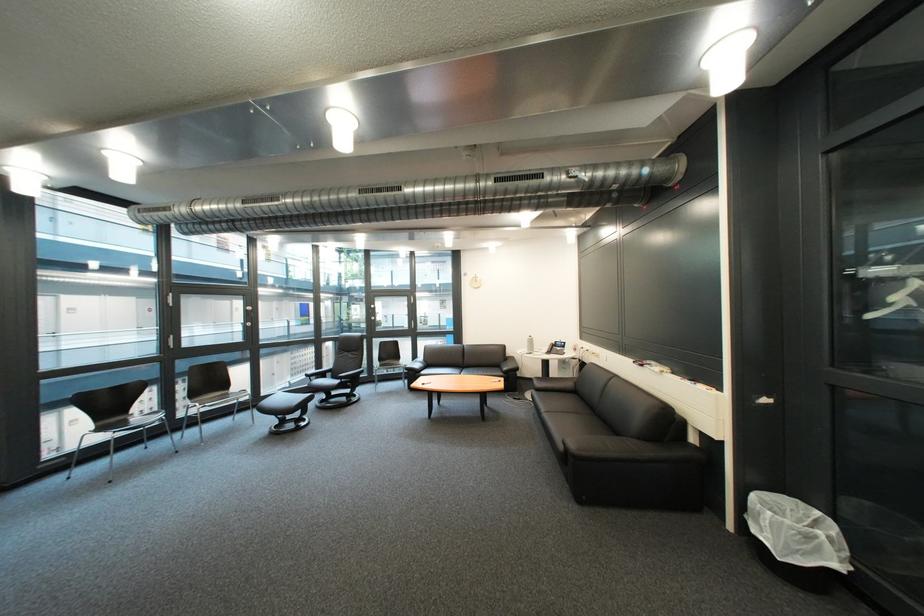
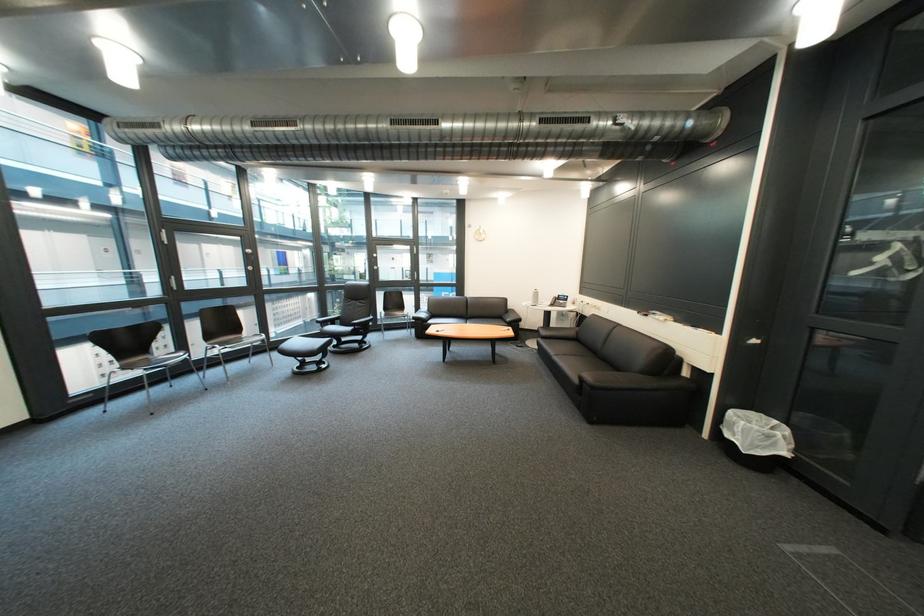
Locate, in the second image, the point that corresponds to pixel 546 352 in the first image.

(552, 305)